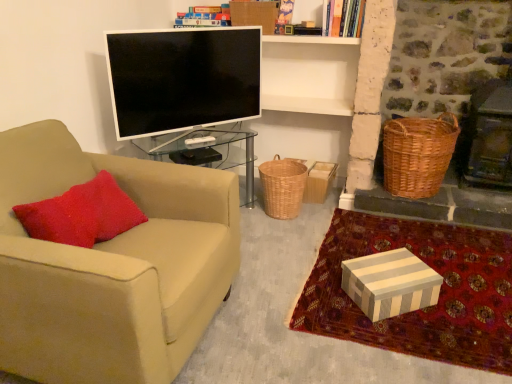
Question: Is woven brown basket at center inside the boundaries of striped cardboard box at lower right, or outside?

Choices:
 (A) outside
 (B) inside

Answer: (A)

Question: Considering the positions of woven brown basket at center and striped cardboard box at lower right in the image, is woven brown basket at center wider or thinner than striped cardboard box at lower right?

Choices:
 (A) thin
 (B) wide

Answer: (B)

Question: Which is farther from the beige fabric chair at left?

Choices:
 (A) woven brown picnic basket at right
 (B) woven brown basket at center
 (C) white striped fabric at lower right
 (D) striped cardboard box at lower right
 (E) hardcover book at upper center

Answer: (E)

Question: Estimate the real-world distances between objects in this image. Which object is closer to the striped cardboard box at lower right?

Choices:
 (A) hardcover book at upper center
 (B) woven brown picnic basket at right
 (C) beige fabric chair at left
 (D) woven brown basket at center
 (E) flat screen tv at center

Answer: (B)